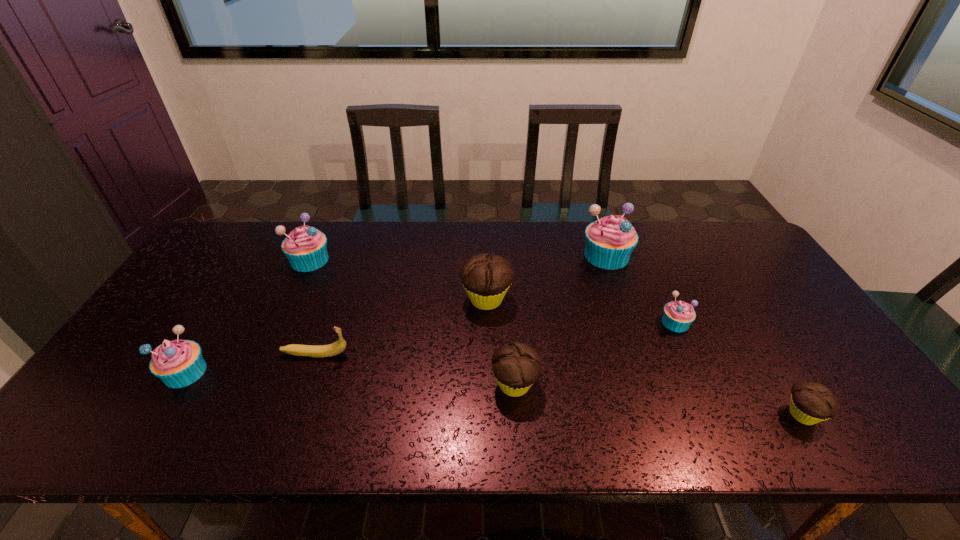
Identify the location of the second object from right to left. (678, 315).

Image resolution: width=960 pixels, height=540 pixels. Find the location of `the smallest chocolate muffin`. the smallest chocolate muffin is located at coordinates (811, 402).

The height and width of the screenshot is (540, 960). I want to click on the rightmost chocolate muffin, so click(811, 402).

At what (x,y) coordinates should I click in order to perform the action: click on vacant area located 0.200m on the right of the third muffin from right to left. Please return your answer as a coordinate pair (x, y). Image resolution: width=960 pixels, height=540 pixels. Looking at the image, I should click on (693, 255).

The image size is (960, 540). What are the coordinates of `vacant space located 0.180m on the front of the sixth muffin from right to left` in the screenshot? It's located at (284, 315).

The width and height of the screenshot is (960, 540). I want to click on free space located on the front of the farthest chocolate muffin, so click(489, 415).

The image size is (960, 540). Identify the location of vacant area located on the back of the leftmost object. (235, 291).

Where is `vacant area situated on the front of the second smallest chocolate muffin`? The width and height of the screenshot is (960, 540). vacant area situated on the front of the second smallest chocolate muffin is located at coordinates (517, 426).

You are a GUI agent. You are given a task and a screenshot of the screen. Output one action in this format:
    pyautogui.click(x=<x>, y=<y>)
    Task: Click on the vacant space located at the stem of the yellow banana
    The image size is (960, 540).
    Given the screenshot: What is the action you would take?
    pyautogui.click(x=419, y=354)

The height and width of the screenshot is (540, 960). I want to click on vacant space located 0.180m on the front of the smallest blue muffin, so click(x=707, y=390).